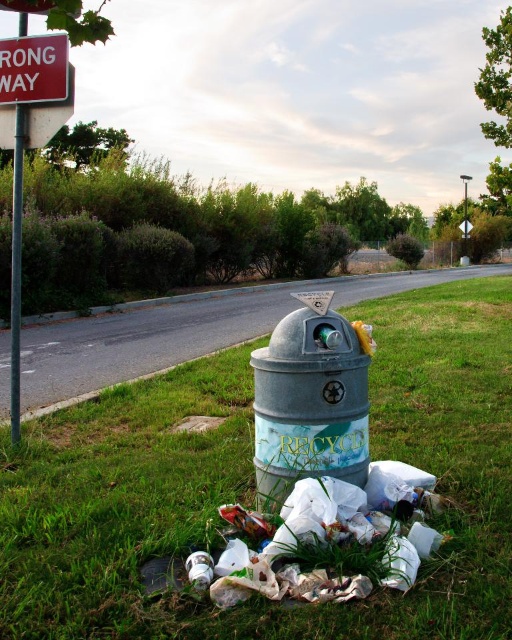
Who is higher up, green grass at lower center or metallic pole at left?

green grass at lower center

Who is more distant from viewer, (407, 456) or (19, 410)?

Positioned behind is point (19, 410).

What are the coordinates of `green grass at lower center` in the screenshot? It's located at pyautogui.click(x=253, y=486).

Based on the photo, who is higher up, red plastic sign at upper left or metallic pole at left?

red plastic sign at upper left is above.

Does red plastic sign at upper left have a larger size compared to metallic pole at left?

Yes.

Is point (14, 72) behind point (19, 250)?

No, it is not.

Identify the location of red plastic sign at upper left. This screenshot has width=512, height=640. (33, 68).

Is point (62, 536) closer to viewer compared to point (47, 36)?

Yes, point (62, 536) is in front of point (47, 36).

Who is shorter, green grass at lower center or red plastic sign at upper left?

With less height is red plastic sign at upper left.

Is point (81, 404) positioned before point (20, 42)?

No, (81, 404) is further to viewer.

At what (x,y) coordinates should I click in order to perform the action: click on green grass at lower center. Please return your answer as a coordinate pair (x, y). This screenshot has height=640, width=512. Looking at the image, I should click on (253, 486).